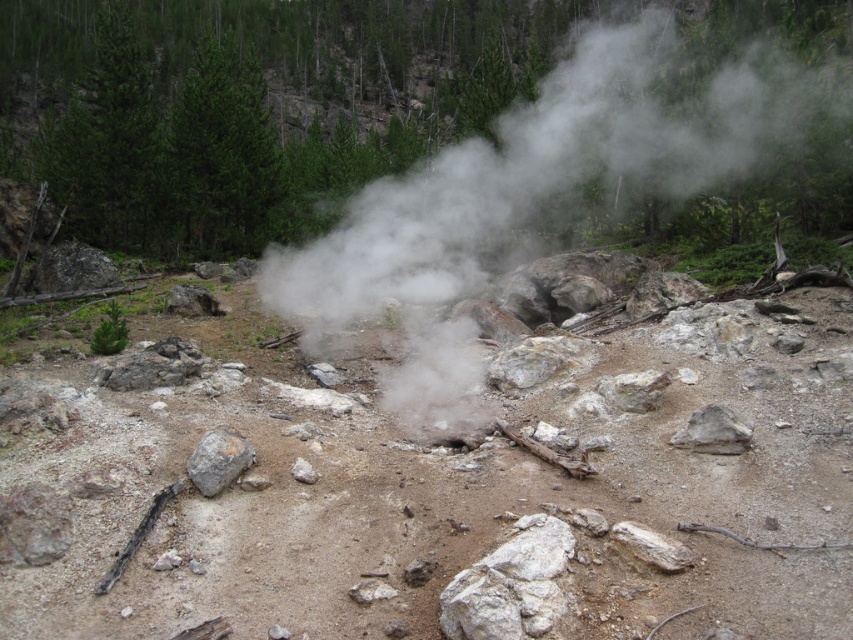
Question: Does white steam at center have a smaller size compared to gray rough rock at lower left?

Choices:
 (A) yes
 (B) no

Answer: (B)

Question: Where is white steam at center located in relation to gray rough rock at lower left in the image?

Choices:
 (A) right
 (B) left

Answer: (A)

Question: Which point is closer to the camera?

Choices:
 (A) (216, 481)
 (B) (695, 420)
 (C) (381, 182)

Answer: (A)

Question: Is white steam at center below gray rough rock at lower left?

Choices:
 (A) yes
 (B) no

Answer: (B)

Question: Which point is farther to the camera?

Choices:
 (A) gray rough rock at center-right
 (B) gray rough rock at lower left
 (C) white steam at center

Answer: (C)

Question: Which object appears farthest from the camera in this image?

Choices:
 (A) gray rough rock at lower left
 (B) white steam at center

Answer: (B)